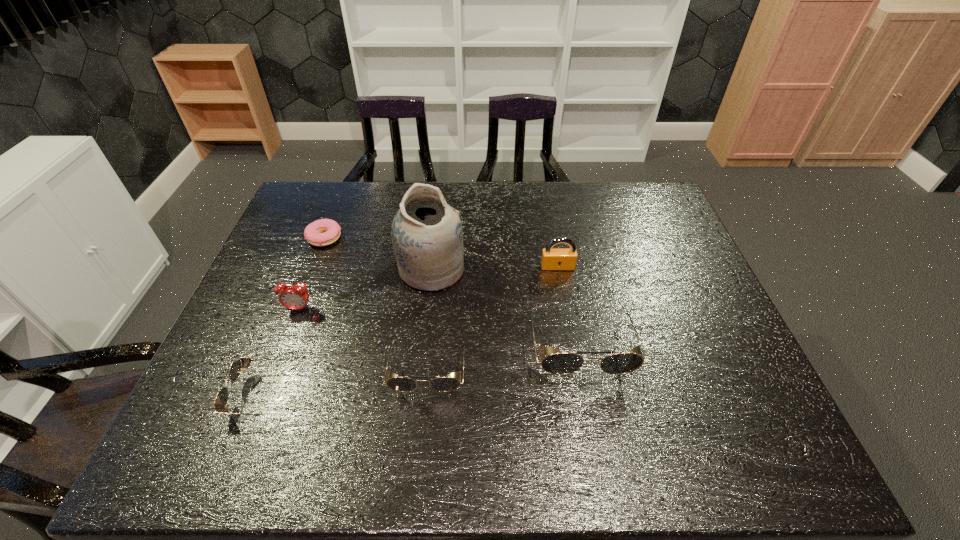
Identify the location of vacant space that's between the alarm clock and the second sunglasses from left to right. Image resolution: width=960 pixels, height=540 pixels. (364, 339).

Where is `vacant point located between the tallest sunglasses and the shortest object`? This screenshot has width=960, height=540. vacant point located between the tallest sunglasses and the shortest object is located at coordinates (451, 292).

Locate an element on the screen. empty space between the alarm clock and the tallest sunglasses is located at coordinates (439, 327).

Locate an element on the screen. The image size is (960, 540). vacant area between the rightmost sunglasses and the pottery is located at coordinates (505, 307).

Locate an element on the screen. The height and width of the screenshot is (540, 960). vacant region between the padlock and the second shortest sunglasses is located at coordinates (492, 318).

Locate an element on the screen. The width and height of the screenshot is (960, 540). vacant space in between the tallest sunglasses and the fifth tallest object is located at coordinates (504, 357).

Choose which object is the fourth nearest neighbor to the alarm clock. Please provide its 2D coordinates. Your answer should be formatted as a tuple, i.e. [(x, y)], where the tuple contains the x and y coordinates of a point satisfying the conditions above.

[(402, 384)]

Locate which object is the third closest to the shortest object. Please provide its 2D coordinates. Your answer should be formatted as a tuple, i.e. [(x, y)], where the tuple contains the x and y coordinates of a point satisfying the conditions above.

[(402, 384)]

Where is `the closest sunglasses to the tallest sunglasses`? This screenshot has width=960, height=540. the closest sunglasses to the tallest sunglasses is located at coordinates (402, 384).

Image resolution: width=960 pixels, height=540 pixels. Find the location of `sunglasses that stands as the second closest to the alarm clock`. sunglasses that stands as the second closest to the alarm clock is located at coordinates (402, 384).